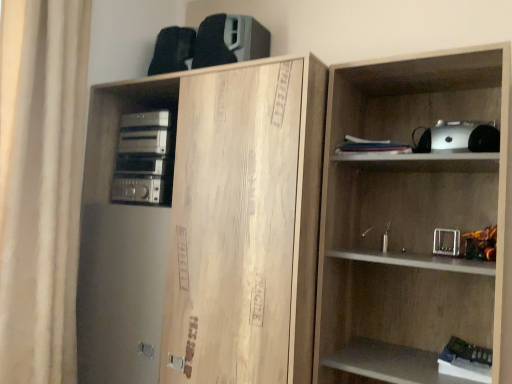
Question: Is white paper stack at upper center, which is the 1th book in top-to-bottom order, located outside wooden shelf at right?

Choices:
 (A) yes
 (B) no

Answer: (B)

Question: Does white paper stack at upper center, positioned as the second book in right-to-left order, have a smaller size compared to wooden shelf at right?

Choices:
 (A) no
 (B) yes

Answer: (B)

Question: Does white paper stack at upper center, the 2th book ordered from the bottom, turn towards wooden shelf at right?

Choices:
 (A) no
 (B) yes

Answer: (B)

Question: Does white paper stack at upper center, which is the first book from left to right, have a greater width compared to wooden shelf at right?

Choices:
 (A) no
 (B) yes

Answer: (A)

Question: Considering the relative positions of white paper stack at upper center, the 2th book ordered from the bottom, and wooden shelf at right in the image provided, is white paper stack at upper center, the 2th book ordered from the bottom, to the left of wooden shelf at right from the viewer's perspective?

Choices:
 (A) yes
 (B) no

Answer: (A)

Question: Does white paper stack at upper center, the 2th book ordered from the bottom, come behind wooden shelf at right?

Choices:
 (A) yes
 (B) no

Answer: (A)

Question: Is white matte book at lower right, marked as the first book in a right-to-left arrangement, facing towards white paper stack at upper center, positioned as the second book in right-to-left order?

Choices:
 (A) no
 (B) yes

Answer: (A)

Question: Considering the relative sizes of white matte book at lower right, marked as the first book in a right-to-left arrangement, and white paper stack at upper center, the 2th book ordered from the bottom, in the image provided, is white matte book at lower right, marked as the first book in a right-to-left arrangement, taller than white paper stack at upper center, the 2th book ordered from the bottom,?

Choices:
 (A) yes
 (B) no

Answer: (B)

Question: From a real-world perspective, is white matte book at lower right, marked as the first book in a right-to-left arrangement, located higher than white paper stack at upper center, positioned as the second book in right-to-left order?

Choices:
 (A) no
 (B) yes

Answer: (A)

Question: Considering the relative sizes of white matte book at lower right, marked as the first book in a right-to-left arrangement, and white paper stack at upper center, the 2th book ordered from the bottom, in the image provided, is white matte book at lower right, marked as the first book in a right-to-left arrangement, thinner than white paper stack at upper center, the 2th book ordered from the bottom,?

Choices:
 (A) no
 (B) yes

Answer: (A)

Question: Can you see white matte book at lower right, the 2th book positioned from the top, touching white paper stack at upper center, which is the first book from left to right?

Choices:
 (A) no
 (B) yes

Answer: (A)

Question: Is white matte book at lower right, the first book in the bottom-to-top sequence, not close to white paper stack at upper center, the 2th book ordered from the bottom?

Choices:
 (A) yes
 (B) no

Answer: (B)

Question: Can you confirm if silver metallic stereo at left is wider than white fabric curtain at left?

Choices:
 (A) no
 (B) yes

Answer: (A)